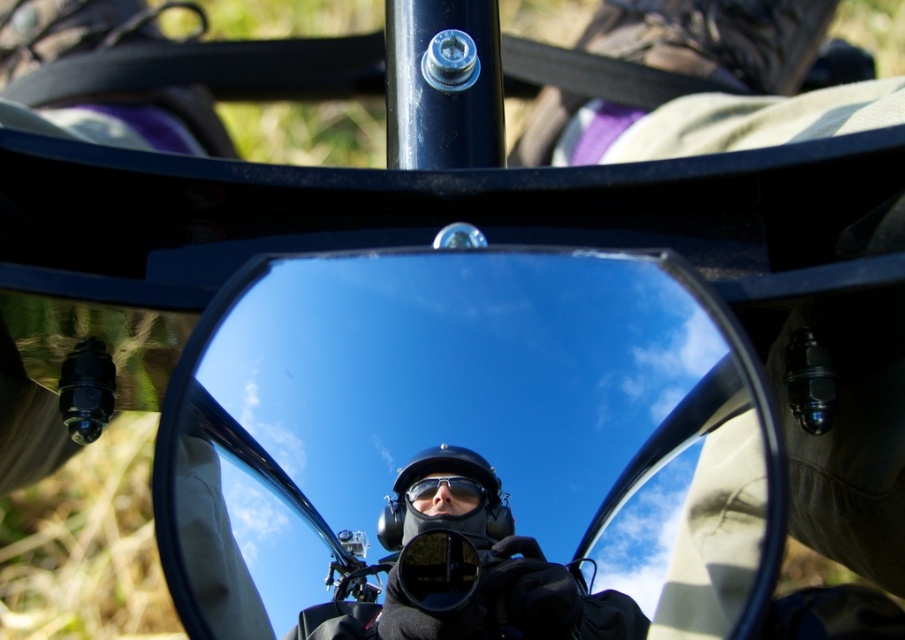
Question: Which of the following is the closest to the observer?

Choices:
 (A) matte black goggles at center
 (B) glossy black mirror at center

Answer: (B)

Question: Which object is the farthest from the black matte helmet at center?

Choices:
 (A) matte black goggles at center
 (B) glossy black mirror at center

Answer: (B)

Question: Is glossy black mirror at center positioned behind matte black goggles at center?

Choices:
 (A) yes
 (B) no

Answer: (B)

Question: Which point appears farthest from the camera in this image?

Choices:
 (A) (588, 628)
 (B) (319, 342)
 (C) (453, 486)

Answer: (B)

Question: Can you confirm if black matte helmet at center is positioned above matte black goggles at center?

Choices:
 (A) yes
 (B) no

Answer: (B)

Question: In this image, where is glossy black mirror at center located relative to black matte helmet at center?

Choices:
 (A) above
 (B) below

Answer: (A)